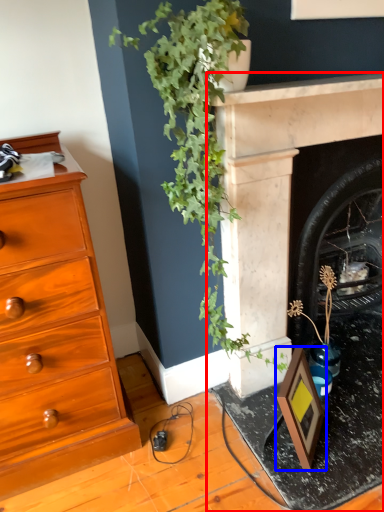
Question: Which point is further to the camera, fireplace (highlighted by a red box) or picture frame (highlighted by a blue box)?

Choices:
 (A) fireplace
 (B) picture frame

Answer: (B)